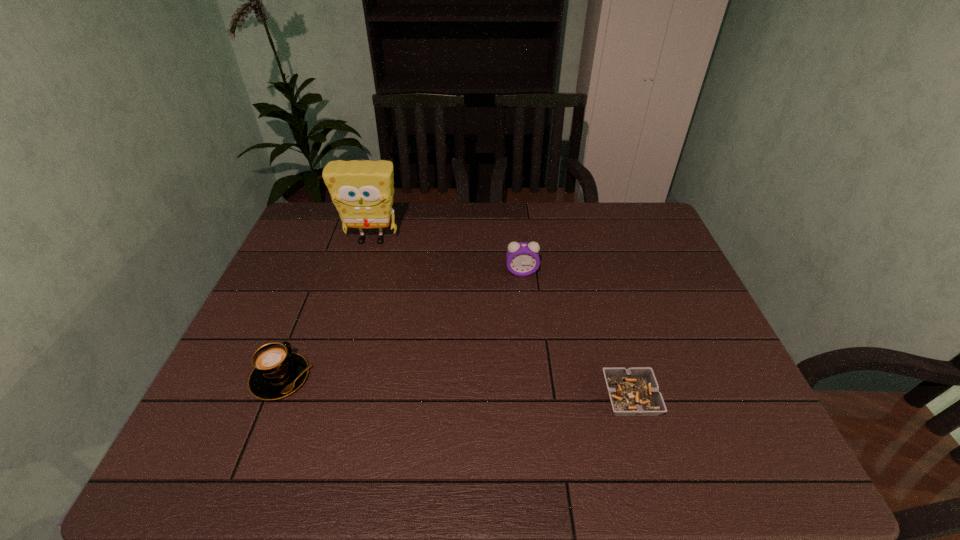
Find the location of `the tallest object`. the tallest object is located at coordinates (362, 191).

The height and width of the screenshot is (540, 960). I want to click on sponge, so click(362, 191).

Identify the location of the third shortest object. Image resolution: width=960 pixels, height=540 pixels. (522, 258).

This screenshot has width=960, height=540. Find the location of `alarm clock`. alarm clock is located at coordinates [x=522, y=258].

The height and width of the screenshot is (540, 960). What are the coordinates of `the second shortest object` in the screenshot? It's located at (277, 373).

Image resolution: width=960 pixels, height=540 pixels. What are the coordinates of `the rightmost object` in the screenshot? It's located at (634, 391).

Identify the location of the shortest object. The image size is (960, 540). (634, 391).

Where is `vacant position located on the face of the farthest object`? vacant position located on the face of the farthest object is located at coordinates (361, 276).

Identify the location of free region located on the face of the second farthest object. Image resolution: width=960 pixels, height=540 pixels. (534, 385).

You are a GUI agent. You are given a task and a screenshot of the screen. Output one action in this format:
    pyautogui.click(x=<x>, y=<y>)
    Task: Click on the free space located 0.290m on the back of the second shortest object
    The height and width of the screenshot is (540, 960).
    Given the screenshot: What is the action you would take?
    321,276